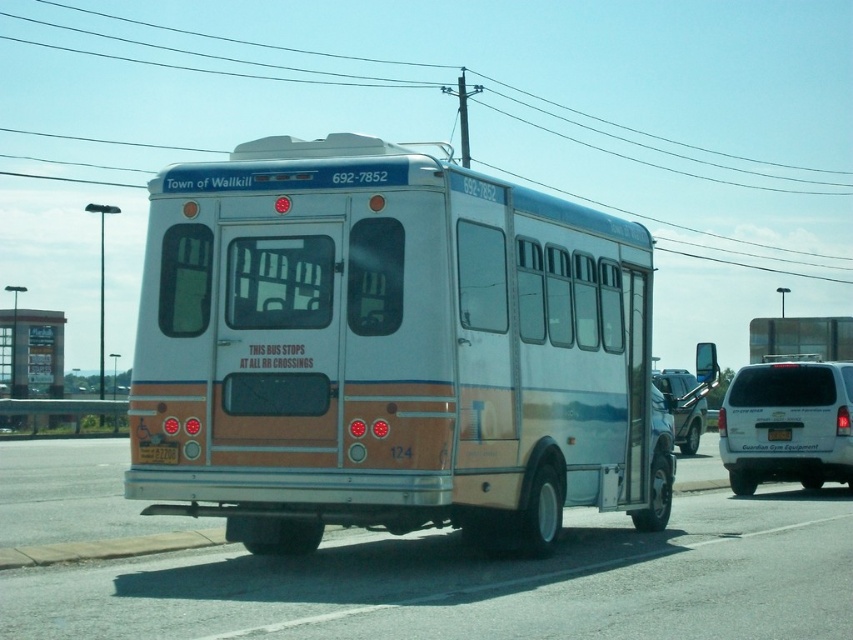
Question: Is white matte van at right further to the viewer compared to yellow plastic license plate at rear center?

Choices:
 (A) yes
 (B) no

Answer: (A)

Question: Which point appears farthest from the camera in this image?

Choices:
 (A) (780, 428)
 (B) (223, 35)
 (C) (171, 449)
 (D) (817, 468)

Answer: (B)

Question: Can you confirm if metallic wire at upper center is positioned below white matte van at right?

Choices:
 (A) no
 (B) yes

Answer: (A)

Question: Which of the following is the farthest from the observer?

Choices:
 (A) (689, 451)
 (B) (782, 432)

Answer: (A)

Question: Does white metallic bus at center appear over white matte van at right?

Choices:
 (A) no
 (B) yes

Answer: (B)

Question: Among these points, which one is farthest from the camera?

Choices:
 (A) (509, 84)
 (B) (693, 451)

Answer: (A)